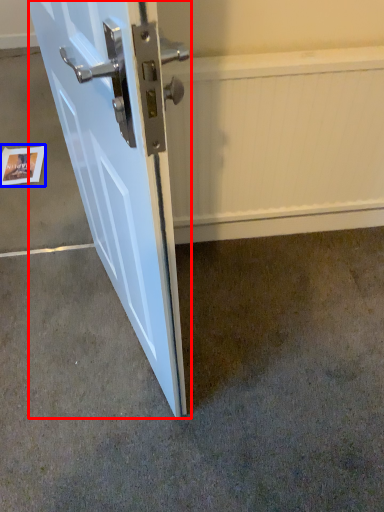
Question: Which of the following is the farthest to the observer, door (highlighted by a red box) or postcard (highlighted by a blue box)?

Choices:
 (A) door
 (B) postcard

Answer: (B)